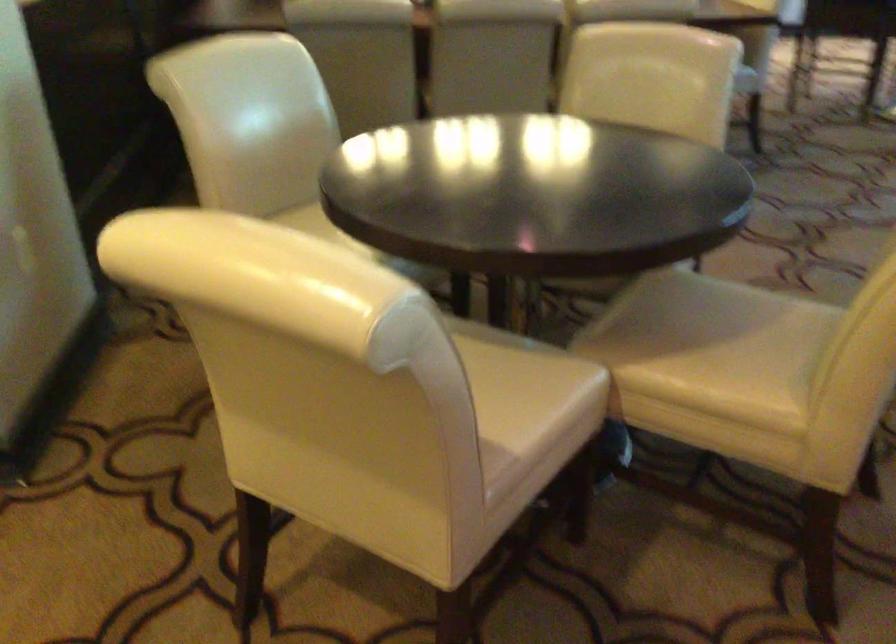
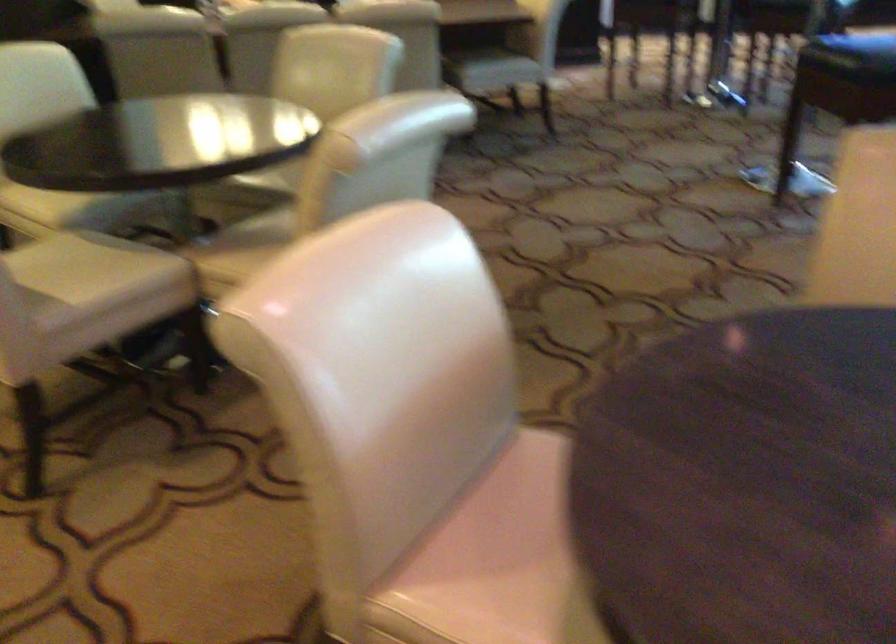
From the picture: Which direction would the cameraman need to move to produce the second image?

The cameraman walked toward right, backward.